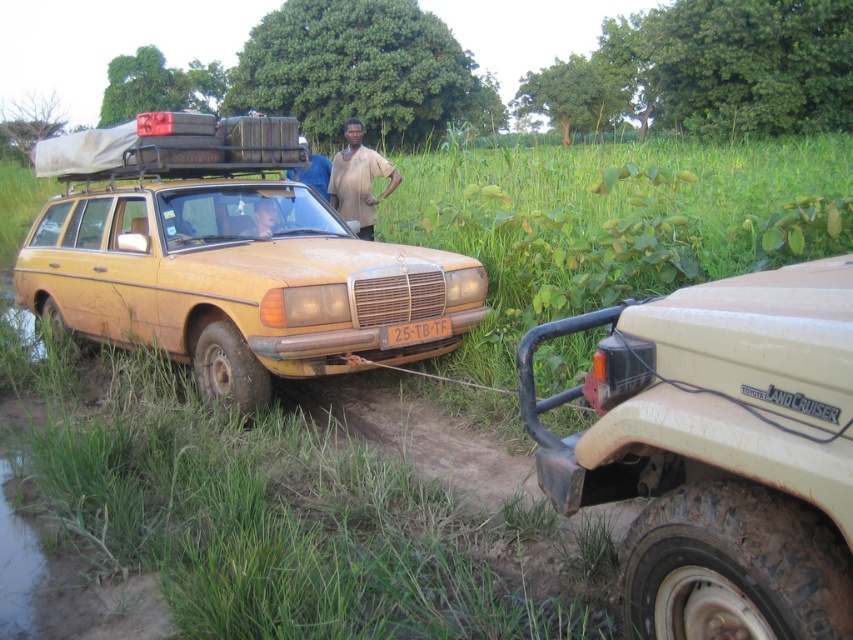
You are a hiker who needs to decide which shirt to wear based on the scene. The brown cotton shirt at center and the blue fabric shirt at center are both visible. Which shirt is positioned lower on your body?

The brown cotton shirt at center is below the blue fabric shirt at center, so the brown cotton shirt at center is positioned lower on the body.